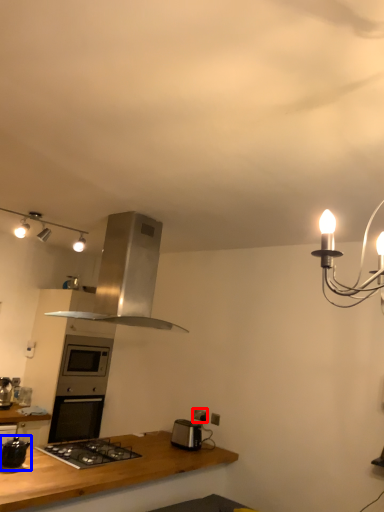
Question: Among these objects, which one is farthest to the camera, electric outlet (highlighted by a red box) or kitchen appliance (highlighted by a blue box)?

Choices:
 (A) electric outlet
 (B) kitchen appliance

Answer: (A)